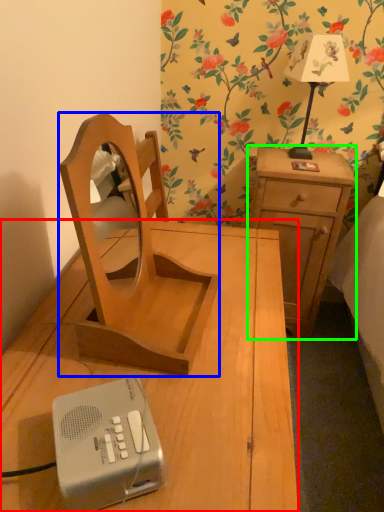
Question: Which object is positioned farthest from nightstand (highlighted by a red box)? Select from furniture (highlighted by a blue box) and nightstand (highlighted by a green box).

Choices:
 (A) furniture
 (B) nightstand

Answer: (B)